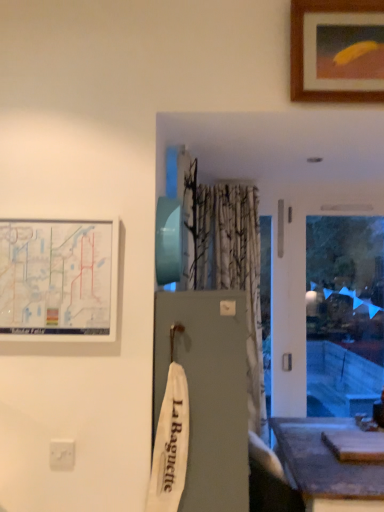
Question: Is wooden picture frame at upper right, the first picture frame viewed from the right, thinner than white matte map at upper left, placed as the 1th picture frame when sorted from left to right?

Choices:
 (A) yes
 (B) no

Answer: (B)

Question: Can you confirm if wooden picture frame at upper right, marked as the first picture frame in a top-to-bottom arrangement, is smaller than white matte map at upper left, marked as the 1th picture frame in a bottom-to-top arrangement?

Choices:
 (A) no
 (B) yes

Answer: (B)

Question: Could you tell me if wooden picture frame at upper right, which is the 2th picture frame from bottom to top, is turned towards white matte map at upper left, marked as the 1th picture frame in a bottom-to-top arrangement?

Choices:
 (A) yes
 (B) no

Answer: (B)

Question: Does wooden picture frame at upper right, which is counted as the 2th picture frame, starting from the left, come behind white matte map at upper left, which is counted as the 2th picture frame, starting from the top?

Choices:
 (A) yes
 (B) no

Answer: (A)

Question: Does wooden picture frame at upper right, marked as the first picture frame in a top-to-bottom arrangement, have a larger size compared to white matte map at upper left, placed as the 1th picture frame when sorted from left to right?

Choices:
 (A) no
 (B) yes

Answer: (A)

Question: Would you say wooden picture frame at upper right, which is counted as the 2th picture frame, starting from the left, is a long distance from white matte map at upper left, placed as the 1th picture frame when sorted from left to right?

Choices:
 (A) yes
 (B) no

Answer: (A)

Question: From a real-world perspective, is white plastic electric outlet at lower left physically below white matte map at upper left, placed as the 1th picture frame when sorted from left to right?

Choices:
 (A) no
 (B) yes

Answer: (B)

Question: Is white plastic electric outlet at lower left outside white matte map at upper left, placed as the 1th picture frame when sorted from left to right?

Choices:
 (A) no
 (B) yes

Answer: (B)

Question: From a real-world perspective, is white plastic electric outlet at lower left physically above white matte map at upper left, which is counted as the 2th picture frame, starting from the top?

Choices:
 (A) yes
 (B) no

Answer: (B)

Question: Is the depth of white plastic electric outlet at lower left less than that of white matte map at upper left, which is counted as the 2th picture frame, starting from the top?

Choices:
 (A) yes
 (B) no

Answer: (B)

Question: From the image's perspective, is white plastic electric outlet at lower left under white matte map at upper left, marked as the 1th picture frame in a bottom-to-top arrangement?

Choices:
 (A) yes
 (B) no

Answer: (A)

Question: Considering the relative sizes of white plastic electric outlet at lower left and white matte map at upper left, which is counted as the 2th picture frame, starting from the top, in the image provided, is white plastic electric outlet at lower left taller than white matte map at upper left, which is counted as the 2th picture frame, starting from the top,?

Choices:
 (A) no
 (B) yes

Answer: (A)

Question: Does wooden picture frame at upper right, which is the 2th picture frame from bottom to top, have a greater height compared to smooth gray table at lower right?

Choices:
 (A) yes
 (B) no

Answer: (B)